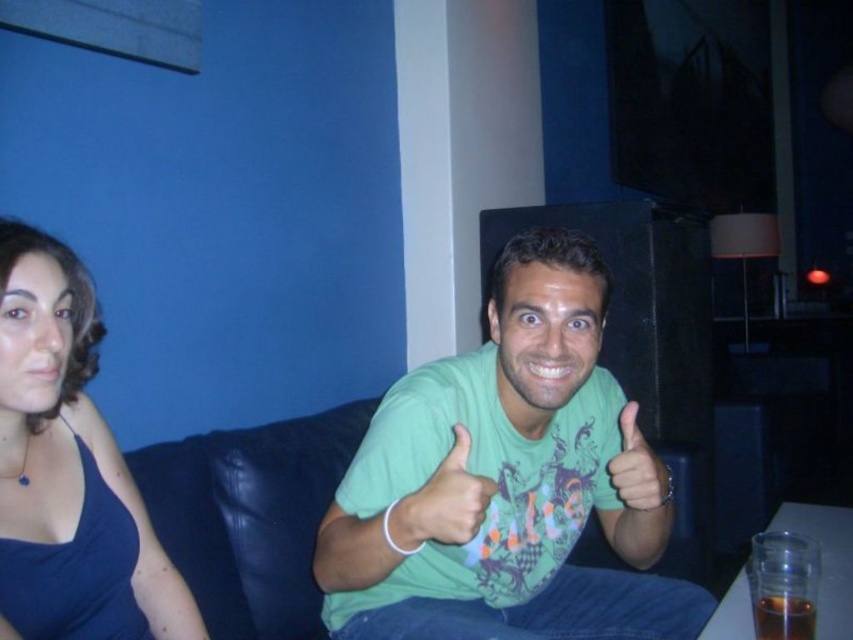
You are a photographer adjusting your camera settings to capture the scene. You notice the matte green hand at center and the translucent glass at lower right. Which object should you focus on first if you want to ensure both are in sharp focus, considering their sizes?

The matte green hand at center is larger in size than the translucent glass at lower right, so focusing on the larger matte green hand at center first would help ensure both are in sharp focus since it requires less precision compared to the smaller translucent glass at lower right.

You are a photographer adjusting the lighting in the room. You notice the matte green hand at center and the translucent glass at lower right. Which object should you focus on to ensure proper exposure since it is closer to the camera?

The matte green hand at center is in front of the translucent glass at lower right, so you should focus on the matte green hand at center for proper exposure as it is closer to the camera.